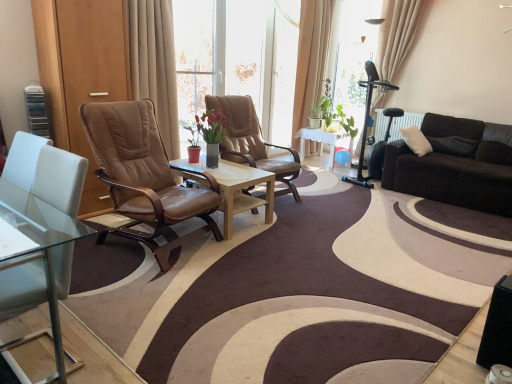
Question: Does beige fabric curtain at upper right, which is the 2th curtain in back-to-front order, have a smaller size compared to brown leather chair at center, acting as the first chair starting from the front?

Choices:
 (A) no
 (B) yes

Answer: (B)

Question: Is beige fabric curtain at upper right, which is the 2th curtain in back-to-front order, not within brown leather chair at center, the 2th chair when ordered from back to front?

Choices:
 (A) no
 (B) yes

Answer: (B)

Question: Are beige fabric curtain at upper right, which is counted as the first curtain, starting from the right, and brown leather chair at center, acting as the first chair starting from the front, beside each other?

Choices:
 (A) no
 (B) yes

Answer: (A)

Question: Does beige fabric curtain at upper right, which is the 2th curtain in back-to-front order, have a larger size compared to brown leather chair at center, acting as the first chair starting from the front?

Choices:
 (A) no
 (B) yes

Answer: (A)

Question: Is the depth of beige fabric curtain at upper right, which appears as the 3th curtain when viewed from the left, less than that of brown leather chair at center, acting as the first chair starting from the front?

Choices:
 (A) yes
 (B) no

Answer: (B)

Question: From a real-world perspective, is beige fabric curtain at upper center, the 2th curtain viewed from the left, physically located above or below transparent glass coffee table at center, the second coffee table positioned from the back?

Choices:
 (A) above
 (B) below

Answer: (A)

Question: Is point (300, 97) closer or farther from the camera than point (2, 261)?

Choices:
 (A) farther
 (B) closer

Answer: (A)

Question: Considering the positions of beige fabric curtain at upper center, the third curtain when ordered from front to back, and transparent glass coffee table at center, the second coffee table positioned from the back, in the image, is beige fabric curtain at upper center, the third curtain when ordered from front to back, wider or thinner than transparent glass coffee table at center, the second coffee table positioned from the back,?

Choices:
 (A) wide
 (B) thin

Answer: (B)

Question: From the image's perspective, is beige fabric curtain at upper center, which is the 2th curtain from right to left, positioned above or below transparent glass coffee table at center, which is the 2th coffee table from right to left?

Choices:
 (A) below
 (B) above

Answer: (B)

Question: Looking at their shapes, would you say light wood/woodenobject at center, which is the first coffee table from right to left, is wider or thinner than green glossy plant at center?

Choices:
 (A) thin
 (B) wide

Answer: (B)

Question: Visually, is light wood/woodenobject at center, which is the first coffee table from right to left, positioned to the left or to the right of green glossy plant at center?

Choices:
 (A) left
 (B) right

Answer: (A)

Question: Relative to green glossy plant at center, is light wood/woodenobject at center, placed as the first coffee table when sorted from back to front, in front or behind?

Choices:
 (A) front
 (B) behind

Answer: (A)

Question: In terms of height, does light wood/woodenobject at center, which is the first coffee table from right to left, look taller or shorter compared to green glossy plant at center?

Choices:
 (A) short
 (B) tall

Answer: (A)

Question: From a real-world perspective, is black leather couch at right physically located above or below leather at center, which ranks as the first chair in back-to-front order?

Choices:
 (A) above
 (B) below

Answer: (B)

Question: In the image, is black leather couch at right on the left side or the right side of leather at center, which ranks as the first chair in back-to-front order?

Choices:
 (A) right
 (B) left

Answer: (A)